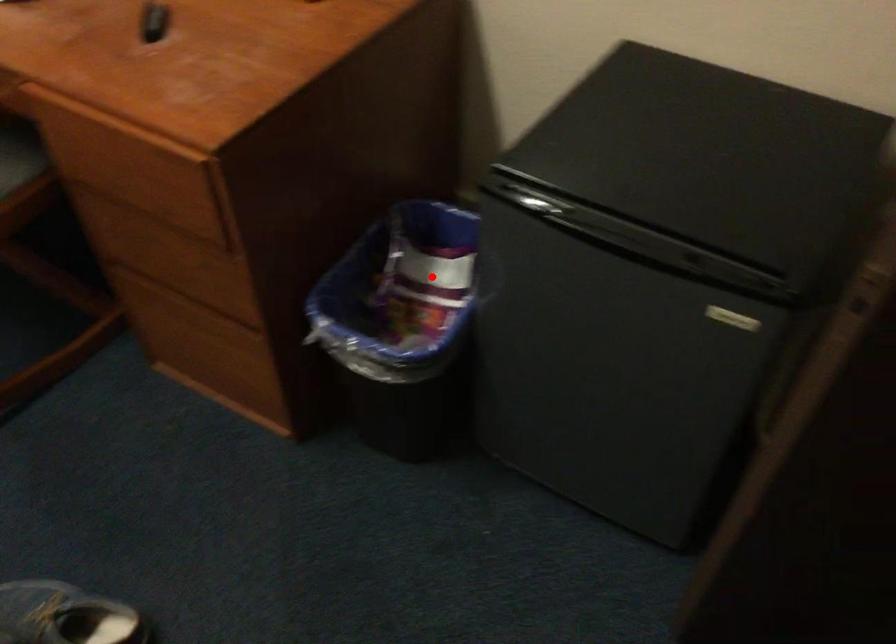
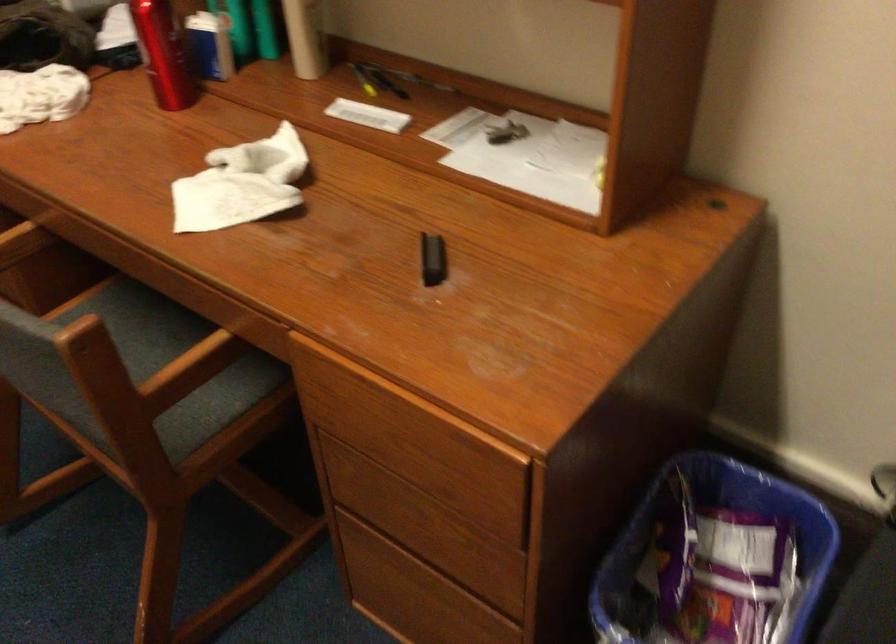
Where in the second image is the point corresponding to the highlighted location from the first image?

(711, 542)